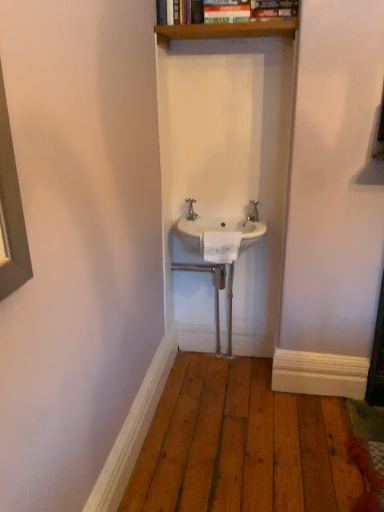
This screenshot has width=384, height=512. I want to click on unoccupied region to the right of silver metallic tap at center, so click(229, 220).